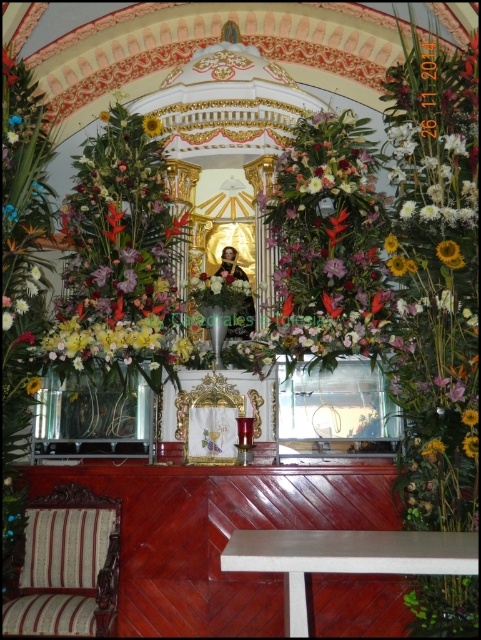
Question: Is floral bouquet at center closer to the viewer compared to yellow matte sunflower at center?

Choices:
 (A) no
 (B) yes

Answer: (B)

Question: Which of these objects is positioned farthest from the yellow matte sunflower at center?

Choices:
 (A) floral bouquet at center
 (B) yellow matte sunflower at upper center

Answer: (B)

Question: Is floral bouquet at center to the right of yellow matte sunflower at center from the viewer's perspective?

Choices:
 (A) yes
 (B) no

Answer: (B)

Question: Which of the following is the closest to the observer?

Choices:
 (A) yellow matte sunflower at center
 (B) yellow matte sunflower at upper center
 (C) floral bouquet at center

Answer: (B)

Question: Which object appears closest to the camera in this image?

Choices:
 (A) yellow matte sunflower at upper center
 (B) yellow matte sunflower at center
 (C) floral bouquet at center

Answer: (A)

Question: Is floral bouquet at center in front of yellow matte sunflower at center?

Choices:
 (A) yes
 (B) no

Answer: (A)